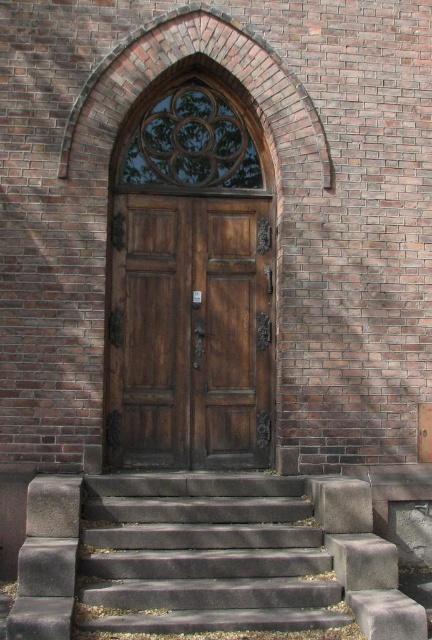
Question: Does polished wood door at center have a smaller size compared to gray concrete stairs at lower center?

Choices:
 (A) no
 (B) yes

Answer: (B)

Question: Can you confirm if polished wood door at center is smaller than gray concrete stairs at lower center?

Choices:
 (A) no
 (B) yes

Answer: (B)

Question: Can you confirm if polished wood door at center is positioned to the left of gray concrete stairs at lower center?

Choices:
 (A) no
 (B) yes

Answer: (A)

Question: Among these objects, which one is farthest from the camera?

Choices:
 (A) gray concrete stairs at lower center
 (B) polished wood door at center

Answer: (B)

Question: Which of the following is the farthest from the observer?

Choices:
 (A) gray concrete stairs at lower center
 (B) polished wood door at center

Answer: (B)